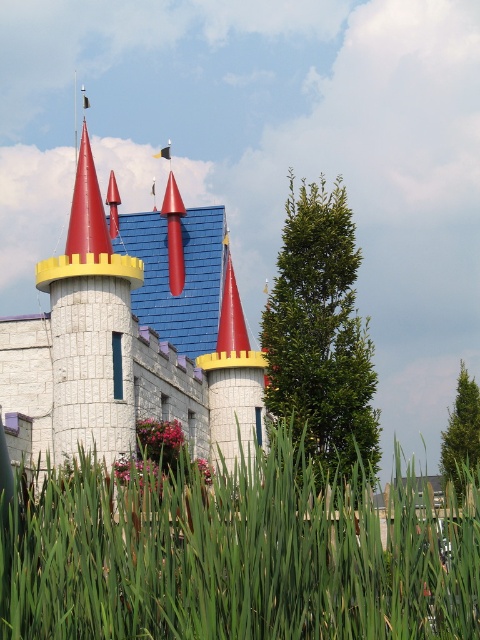
Looking at this image, is green grass at lower center to the right of white plastic castle at center from the viewer's perspective?

Correct, you'll find green grass at lower center to the right of white plastic castle at center.

Is green grass at lower center above white plastic castle at center?

No.

Image resolution: width=480 pixels, height=640 pixels. In order to click on green grass at lower center in this screenshot , I will do `click(233, 557)`.